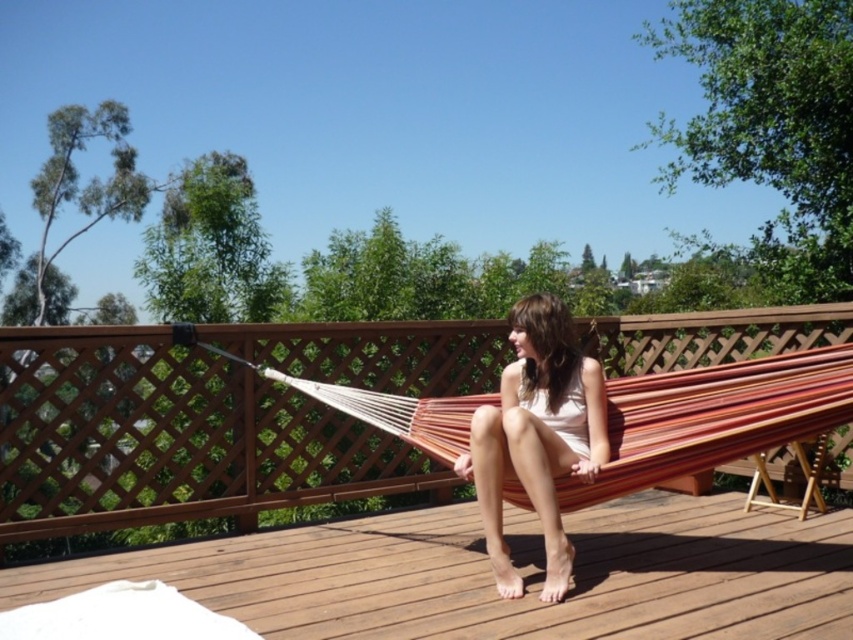
What do you see at coordinates (519, 570) in the screenshot? I see `wooden deck at center` at bounding box center [519, 570].

From the picture: Is wooden deck at center closer to the viewer compared to matte beige dress at center?

Yes, it is in front of matte beige dress at center.

Does point (471, 620) come behind point (601, 464)?

No, (471, 620) is closer to viewer.

Where is `wooden deck at center`? The height and width of the screenshot is (640, 853). wooden deck at center is located at coordinates (519, 570).

Can you confirm if natural wood hammock at center is thinner than wooden deck at center?

Yes.

Based on the photo, between natural wood hammock at center and wooden deck at center, which one appears on the right side from the viewer's perspective?

Positioned to the right is wooden deck at center.

Consider the image. Who is more distant from viewer, (224,480) or (387,605)?

The point (224,480) is behind.

The width and height of the screenshot is (853, 640). Identify the location of natural wood hammock at center. (170, 436).

Describe the element at coordinates (170, 436) in the screenshot. I see `natural wood hammock at center` at that location.

Is point (465, 364) behind point (552, 404)?

Yes, it is behind point (552, 404).

Find the location of a particular element. The width and height of the screenshot is (853, 640). natural wood hammock at center is located at coordinates (170, 436).